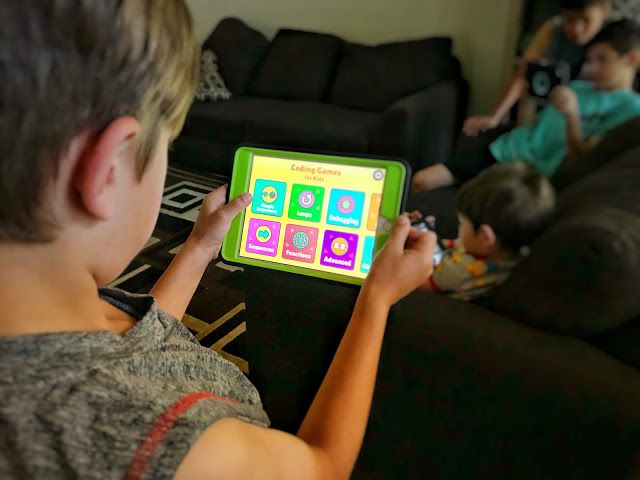
Image resolution: width=640 pixels, height=480 pixels. Identify the location of black sofas. (292, 102), (547, 326).